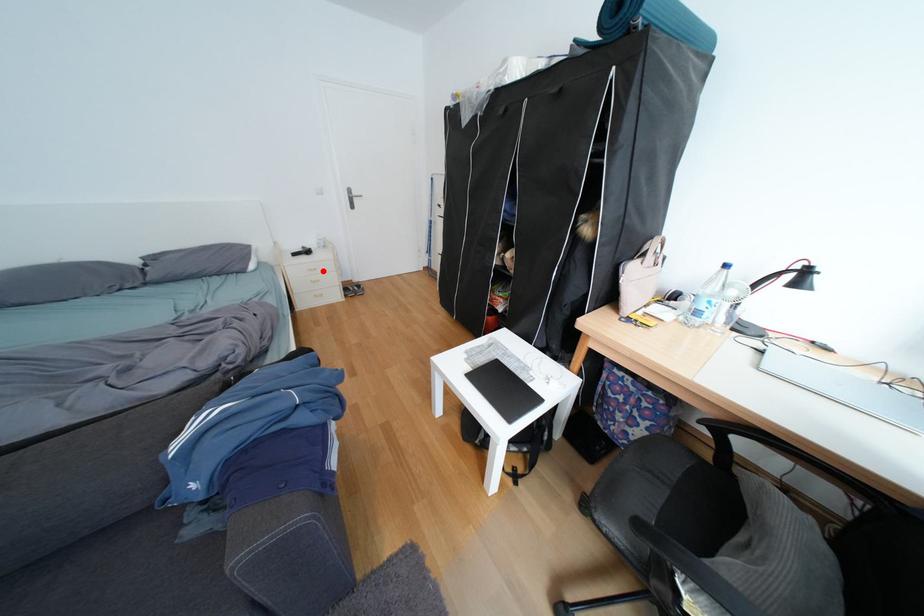
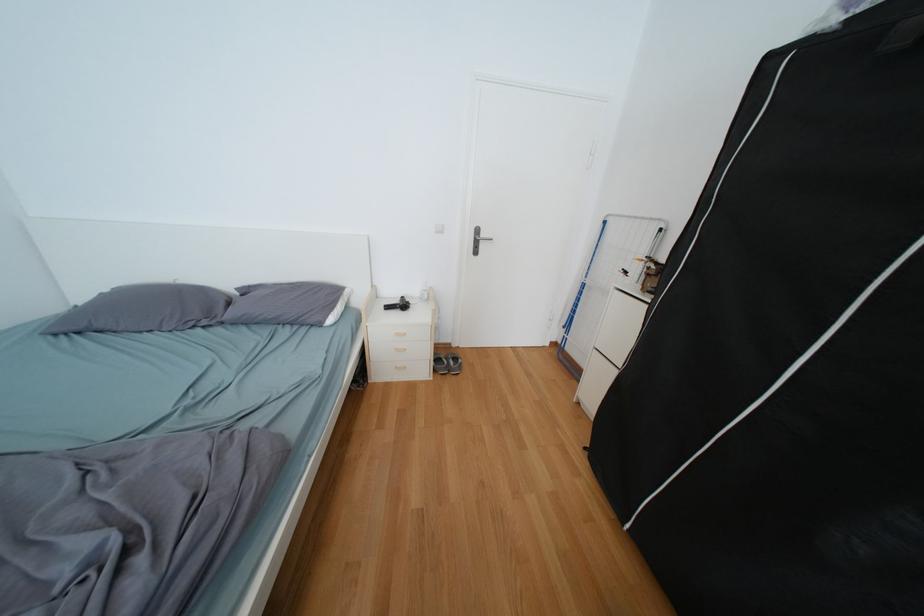
In the second image, find the point that corresponds to the highlighted location in the first image.

(409, 334)